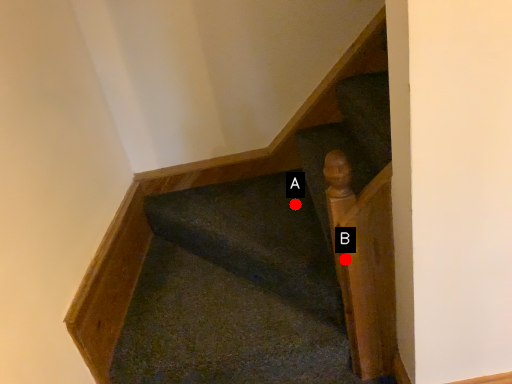
Question: Two points are circled on the image, labeled by A and B beside each circle. Which point appears farthest from the camera in this image?

Choices:
 (A) A is further
 (B) B is further

Answer: (A)